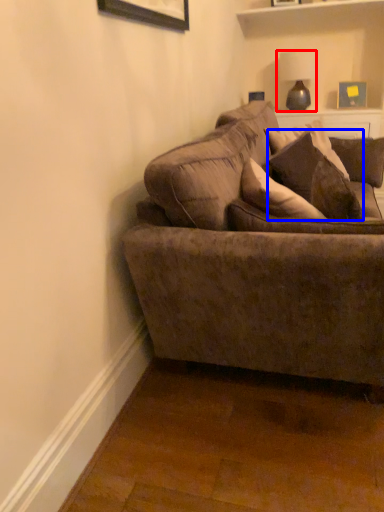
Question: Which point is closer to the camera, lamp (highlighted by a red box) or pillow (highlighted by a blue box)?

Choices:
 (A) lamp
 (B) pillow

Answer: (B)